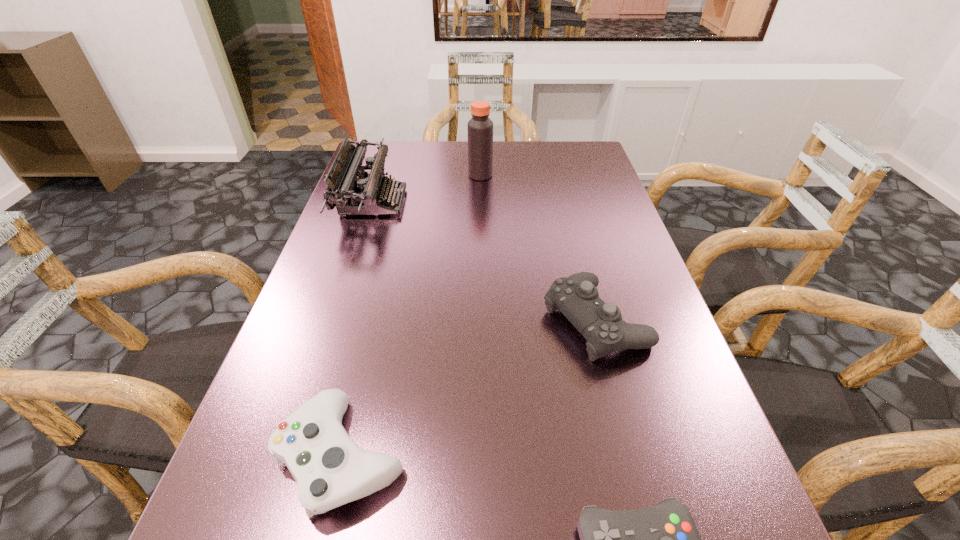
Find the location of a particular element. vacant space that's between the leftmost control and the tallest object is located at coordinates (412, 315).

Where is `vacant point located between the leftmost control and the tallest object`? Image resolution: width=960 pixels, height=540 pixels. vacant point located between the leftmost control and the tallest object is located at coordinates (412, 315).

Locate an element on the screen. The height and width of the screenshot is (540, 960). vacant space that's between the tallest control and the tallest object is located at coordinates (538, 248).

Where is `vacant space that's between the third object from right to left and the third tallest object`? vacant space that's between the third object from right to left and the third tallest object is located at coordinates (538, 248).

This screenshot has width=960, height=540. Find the location of `vacant point located between the farthest control and the third object from right to left`. vacant point located between the farthest control and the third object from right to left is located at coordinates (538, 248).

I want to click on blank region between the second tallest object and the tallest object, so click(427, 188).

Image resolution: width=960 pixels, height=540 pixels. What are the coordinates of `object that can be found as the third closest to the third object from left to right` in the screenshot? It's located at (330, 469).

You are a GUI agent. You are given a task and a screenshot of the screen. Output one action in this format:
    pyautogui.click(x=<x>, y=<y>)
    Task: Click on the object that stands as the third closest to the tallest object
    This screenshot has height=540, width=960.
    Given the screenshot: What is the action you would take?
    pyautogui.click(x=330, y=469)

Select which control appears as the second closest to the leftmost control. Please provide its 2D coordinates. Your answer should be formatted as a tuple, i.e. [(x, y)], where the tuple contains the x and y coordinates of a point satisfying the conditions above.

[(576, 297)]

The image size is (960, 540). Identify the location of the second closest control to the third shortest object. (330, 469).